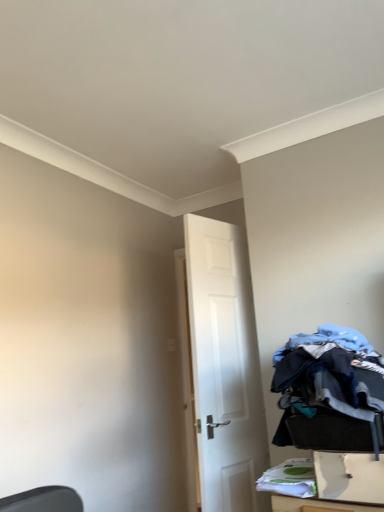
Question: Based on their positions, is white plastic drawer at lower right located to the left or right of white matte door at center?

Choices:
 (A) right
 (B) left

Answer: (A)

Question: Does point (317, 489) appear closer or farther from the camera than point (210, 273)?

Choices:
 (A) farther
 (B) closer

Answer: (B)

Question: Which object is the closest to the denim fabric laundry at lower right?

Choices:
 (A) white plastic drawer at lower right
 (B) white matte door at center

Answer: (A)

Question: Which object is the closest to the denim fabric laundry at lower right?

Choices:
 (A) white plastic drawer at lower right
 (B) white matte door at center

Answer: (A)